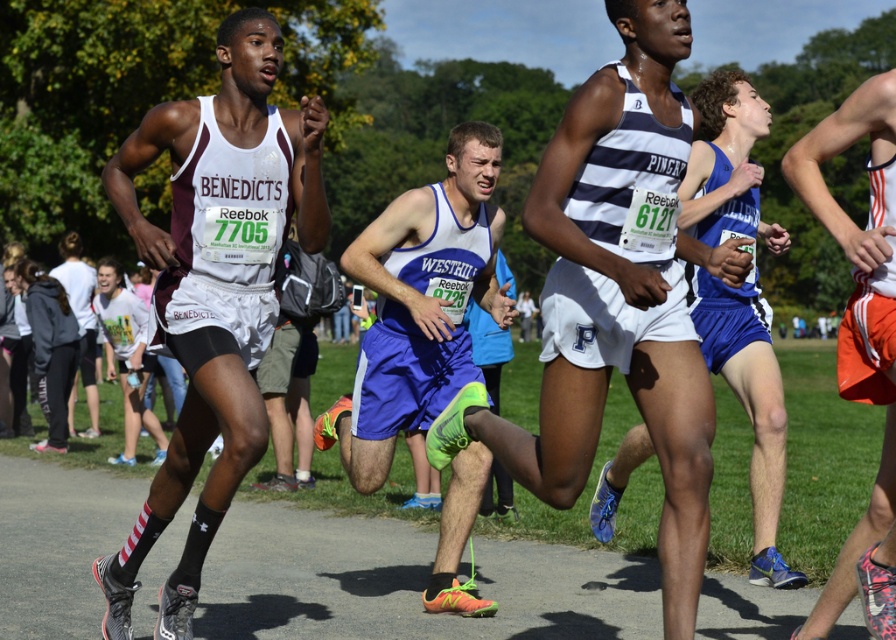
Which is below, blue jersey at center or orange fabric shorts at right?

blue jersey at center is lower down.

Is blue jersey at center bigger than orange fabric shorts at right?

No.

At what (x,y) coordinates should I click in order to perform the action: click on blue jersey at center. Please return your answer as a coordinate pair (x, y). The image size is (896, 640). Looking at the image, I should click on (748, 401).

Which is below, orange fabric shorts at right or white matte t-shirt at lower left?

white matte t-shirt at lower left

From the picture: Does orange fabric shorts at right appear under white matte t-shirt at lower left?

Incorrect, orange fabric shorts at right is not positioned below white matte t-shirt at lower left.

Which is behind, point (793, 186) or point (109, 280)?

Point (109, 280)

This screenshot has width=896, height=640. Find the location of `orange fabric shorts at right`. orange fabric shorts at right is located at coordinates (860, 339).

Who is shorter, maroon jersey at center or blue fabric shorts at center?

Standing shorter between the two is blue fabric shorts at center.

Between point (205, 496) and point (453, 344), which one is positioned in front?

Point (205, 496)

Locate an element on the screen. maroon jersey at center is located at coordinates (214, 288).